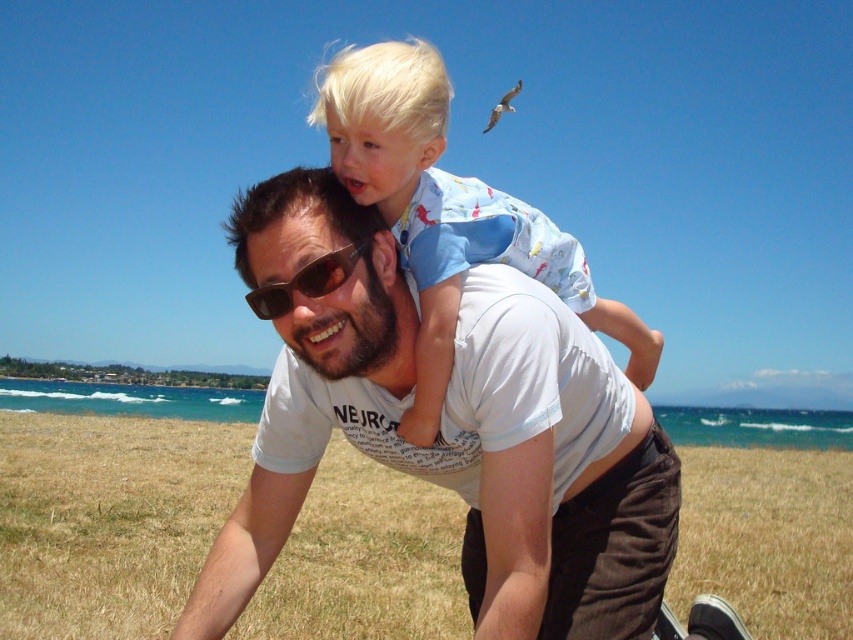
Between white cotton shirt at center and light blue cotton shirt at center, which one is positioned lower?

white cotton shirt at center is below.

Measure the distance from white cotton shirt at center to light blue cotton shirt at center.

They are 1.71 meters apart.

Which is behind, point (364, 323) or point (532, 240)?

The point (532, 240) is more distant.

The image size is (853, 640). Identify the location of white cotton shirt at center. (448, 428).